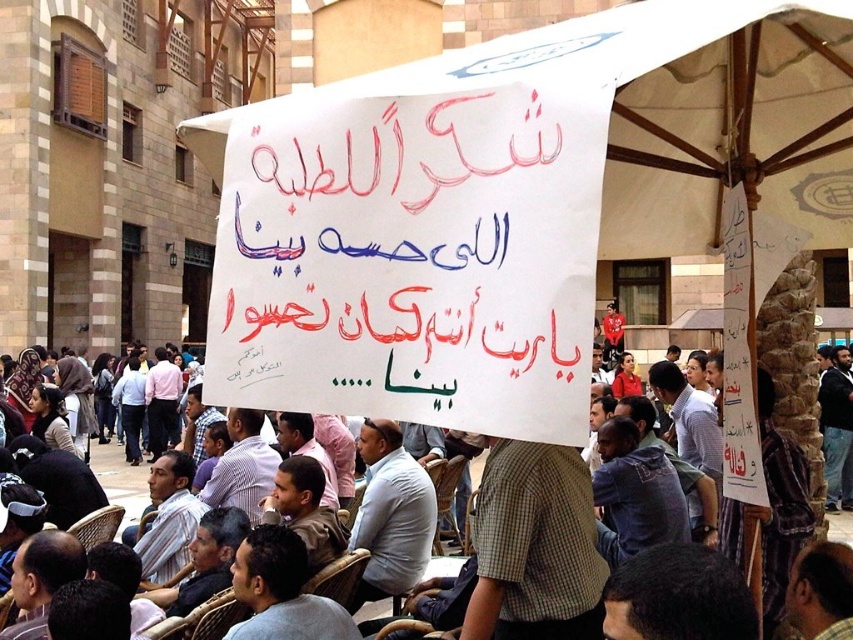
What do you see at coordinates (120, 481) in the screenshot?
I see `white paper sign at center` at bounding box center [120, 481].

Is white paper sign at center shorter than wooden textured chair at center?

In fact, white paper sign at center may be taller than wooden textured chair at center.

Does point (129, 476) lie in front of point (440, 464)?

That is False.

This screenshot has width=853, height=640. I want to click on white paper sign at center, so click(120, 481).

Measure the distance between white paper sign at center and camera.

white paper sign at center is 29.95 meters away from camera.

From the picture: Does white paper sign at center have a larger size compared to brown woven chair at lower center?

Yes, white paper sign at center is bigger than brown woven chair at lower center.

You are a GUI agent. You are given a task and a screenshot of the screen. Output one action in this format:
    pyautogui.click(x=<x>, y=<y>)
    Task: Click on the white paper sign at center
    This screenshot has height=640, width=853.
    Given the screenshot: What is the action you would take?
    pyautogui.click(x=120, y=481)

Find the location of a particular element. Image resolution: width=853 pixels, height=640 pixels. wooden textured chair at center is located at coordinates (445, 492).

Can you confirm if wooden textured chair at center is positioned to the right of brown woven chair at lower center?

Yes, wooden textured chair at center is to the right of brown woven chair at lower center.

Which is behind, point (456, 480) or point (107, 540)?

Point (456, 480)

At what (x,y) coordinates should I click in order to perform the action: click on wooden textured chair at center. Please return your answer as a coordinate pair (x, y). This screenshot has height=640, width=853. Looking at the image, I should click on (445, 492).